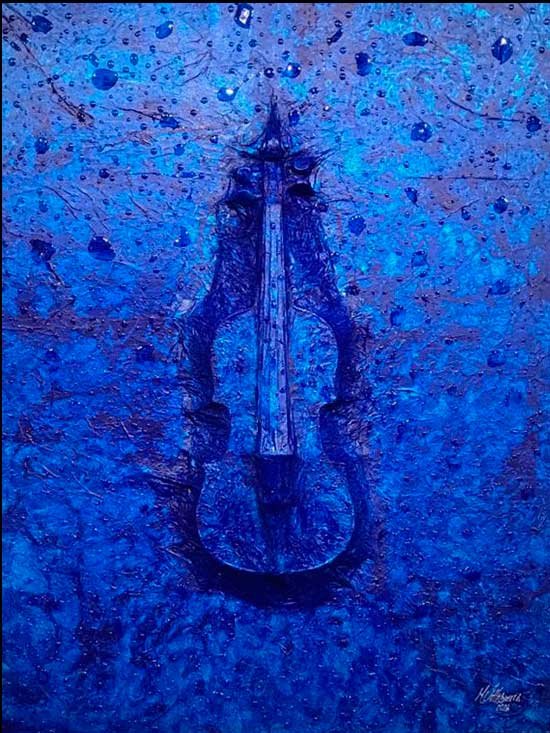
The image size is (550, 733). What are the coordinates of `art` in the screenshot? It's located at (352, 254).